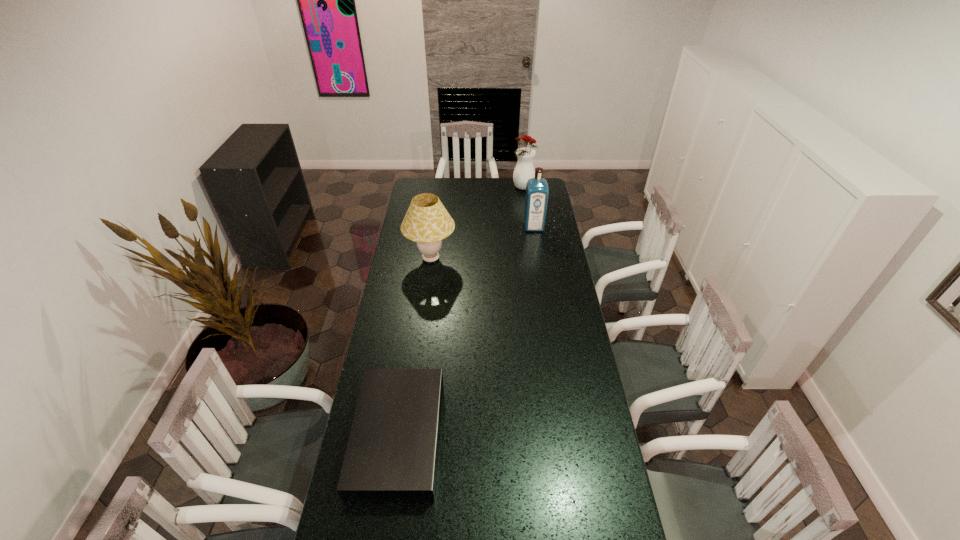
Locate an element on the screen. This screenshot has height=540, width=960. lampshade at the left edge is located at coordinates (427, 222).

This screenshot has width=960, height=540. Identify the location of CD player present at the left edge. (392, 452).

Identify the location of vase that is at the right edge. (524, 170).

Locate an element on the screen. liquor that is at the right edge is located at coordinates (537, 191).

In order to click on object that is at the far right corner in this screenshot , I will do click(524, 170).

Where is `free space at the far edge of the desktop`? free space at the far edge of the desktop is located at coordinates (505, 193).

Where is `free spot at the left edge of the desktop`? The image size is (960, 540). free spot at the left edge of the desktop is located at coordinates (393, 313).

Locate an element on the screen. vacant position at the right edge of the desktop is located at coordinates (559, 232).

Find the location of a particular element. The image size is (960, 540). vacant area at the far right corner of the desktop is located at coordinates (548, 184).

Where is `free point between the farthest object and the lampshade`? free point between the farthest object and the lampshade is located at coordinates (477, 224).